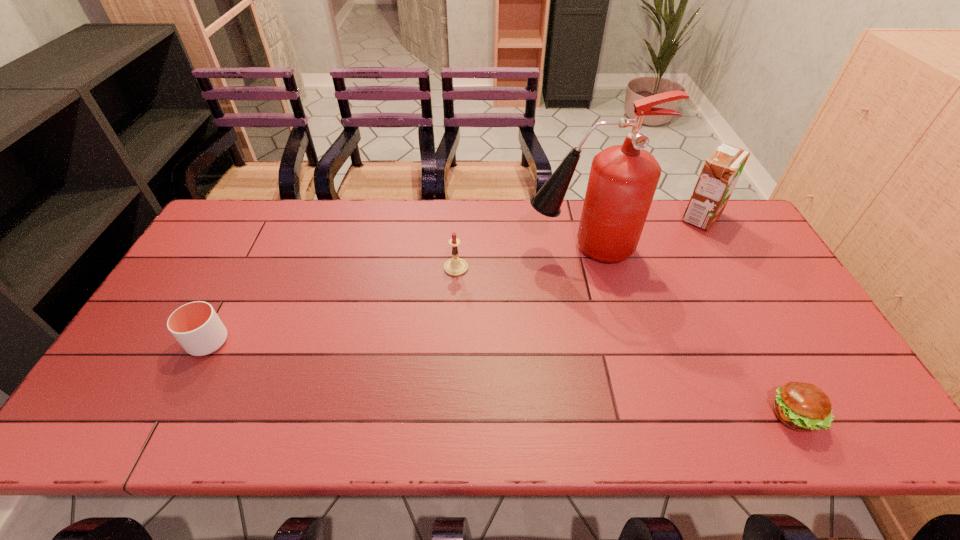
Where is `free space that satisfies the following two spatial constraints: 1. with the nozzle aimed from the third object from right to left; 2. on the left side of the hamburger`? This screenshot has width=960, height=540. free space that satisfies the following two spatial constraints: 1. with the nozzle aimed from the third object from right to left; 2. on the left side of the hamburger is located at coordinates (621, 416).

Where is `blank space that satisfies the following two spatial constraints: 1. on the back side of the fourth object from right to left; 2. on the right side of the fourth farthest object`? blank space that satisfies the following two spatial constraints: 1. on the back side of the fourth object from right to left; 2. on the right side of the fourth farthest object is located at coordinates (247, 268).

The height and width of the screenshot is (540, 960). I want to click on free point that satisfies the following two spatial constraints: 1. on the straw side of the second tallest object; 2. on the front side of the shortest object, so click(x=811, y=416).

At what (x,y) coordinates should I click in order to perform the action: click on vacant point that satisfies the following two spatial constraints: 1. with the nozzle aimed from the fire extinguisher; 2. on the front side of the cup. Please return your answer as a coordinate pair (x, y). This screenshot has height=540, width=960. Looking at the image, I should click on (604, 342).

Where is `vacant space that satisfies the following two spatial constraints: 1. on the back side of the cup; 2. on the right side of the fourth object from right to left`? Image resolution: width=960 pixels, height=540 pixels. vacant space that satisfies the following two spatial constraints: 1. on the back side of the cup; 2. on the right side of the fourth object from right to left is located at coordinates (247, 268).